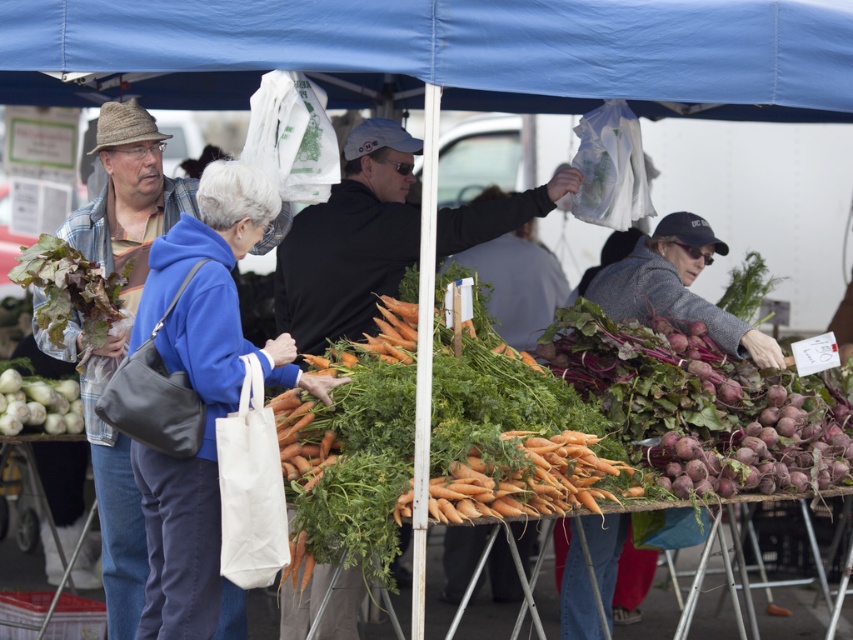
Question: Which is farther from the white matte fennel at lower left?

Choices:
 (A) plaid flannel shirt at left
 (B) blue fleece jacket at center
 (C) dark green leafy vegetable at left

Answer: (B)

Question: Is blue fleece jacket at center closer to camera compared to white matte fennel at lower left?

Choices:
 (A) yes
 (B) no

Answer: (A)

Question: Which of the following is the closest to the observer?

Choices:
 (A) (532, 125)
 (B) (566, 454)
 (C) (602, 4)
 (D) (88, 212)

Answer: (C)

Question: Does blue fleece jacket at center appear on the right side of orange matte carrots at center?

Choices:
 (A) yes
 (B) no

Answer: (B)

Question: Which of these objects is positioned farthest from the black matte jacket at center?

Choices:
 (A) blue fabric canopy at upper center
 (B) plaid flannel shirt at left
 (C) dark green leafy vegetable at left
 (D) gray woolen jacket at center

Answer: (A)

Question: Is blue fabric canopy at upper center wider than black matte jacket at center?

Choices:
 (A) no
 (B) yes

Answer: (B)